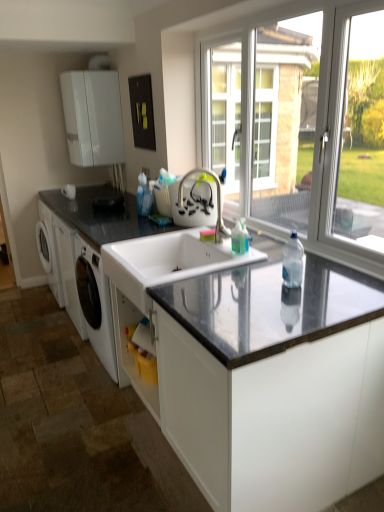
This screenshot has width=384, height=512. In order to click on free spot to the right of clear plastic bottle at center in this screenshot , I will do `click(339, 288)`.